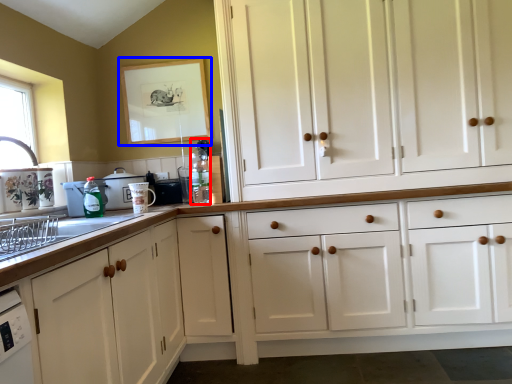
Question: Which point is further to the camera, bottle (highlighted by a red box) or picture frame (highlighted by a blue box)?

Choices:
 (A) bottle
 (B) picture frame

Answer: (B)